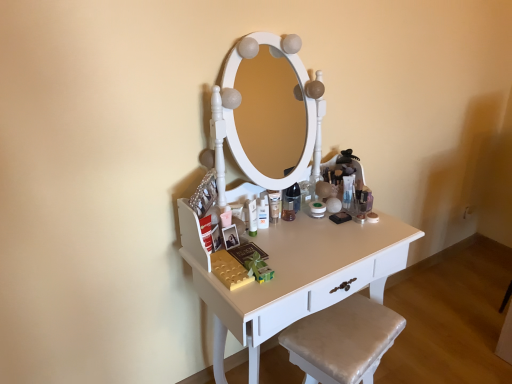
What is the approximate width of translucent plastic tube at center, arranged as the second toiletry when viewed from the front?

The width of translucent plastic tube at center, arranged as the second toiletry when viewed from the front, is 1.48 inches.

How much space does matte white lotion at center, which is the second toiletry in back-to-front order, occupy vertically?

The height of matte white lotion at center, which is the second toiletry in back-to-front order, is 5.04 inches.

The image size is (512, 384). In order to click on matte white lotion at center, which is the first toiletry from left to right in this screenshot , I will do `click(252, 217)`.

The image size is (512, 384). What do you see at coordinates (342, 340) in the screenshot?
I see `satin beige cushion at lower right` at bounding box center [342, 340].

Find the location of `white glossy table at center`. white glossy table at center is located at coordinates (296, 275).

Could you tell me if satin beige cushion at lower right is facing translucent plastic tube at center, arranged as the 1th toiletry when viewed from the right?

No.

Based on their positions, is satin beige cushion at lower right located to the left or right of translucent plastic tube at center, arranged as the 1th toiletry when viewed from the right?

From the image, it's evident that satin beige cushion at lower right is to the left of translucent plastic tube at center, arranged as the 1th toiletry when viewed from the right.

From a real-world perspective, between satin beige cushion at lower right and translucent plastic tube at center, arranged as the 1th toiletry when viewed from the right, who is vertically lower?

satin beige cushion at lower right is physically lower.

Is the position of satin beige cushion at lower right less distant than that of white glossy table at center?

No, it is not.

Considering the relative sizes of satin beige cushion at lower right and white glossy table at center in the image provided, is satin beige cushion at lower right wider than white glossy table at center?

In fact, satin beige cushion at lower right might be narrower than white glossy table at center.

Considering the relative sizes of satin beige cushion at lower right and white glossy table at center in the image provided, is satin beige cushion at lower right taller than white glossy table at center?

In fact, satin beige cushion at lower right may be shorter than white glossy table at center.

Which is farther, [351,187] or [295,340]?

The point [351,187] is more distant.

At what (x,y) coordinates should I click in order to perform the action: click on toiletry that is the 2nd object above the satin beige cushion at lower right (from a real-world perspective). Please return your answer as a coordinate pair (x, y). Looking at the image, I should click on (348, 190).

Is translucent plastic tube at center, the second toiletry viewed from the left, placed right next to satin beige cushion at lower right?

No, translucent plastic tube at center, the second toiletry viewed from the left, is not in contact with satin beige cushion at lower right.

Which is nearer, (273, 236) or (247, 207)?

Clearly, point (273, 236) is closer to the camera than point (247, 207).

From the image's perspective, is white glossy table at center above matte white lotion at center, the second toiletry from the right?

Actually, white glossy table at center appears below matte white lotion at center, the second toiletry from the right, in the image.

Could you tell me if white glossy table at center is facing matte white lotion at center, the second toiletry from the right?

No, white glossy table at center does not turn towards matte white lotion at center, the second toiletry from the right.

Are white glossy table at center and matte white lotion at center, the 1th toiletry from the front, making contact?

No, white glossy table at center is not beside matte white lotion at center, the 1th toiletry from the front.

Does white glossy table at center contain translucent plastic tube at center, arranged as the 1th toiletry when viewed from the right?

No, translucent plastic tube at center, arranged as the 1th toiletry when viewed from the right, is not a part of white glossy table at center.

Can you confirm if white glossy table at center is bigger than translucent plastic tube at center, the first toiletry positioned from the back?

Yes, white glossy table at center is bigger than translucent plastic tube at center, the first toiletry positioned from the back.

Is white glossy table at center placed right next to translucent plastic tube at center, arranged as the 1th toiletry when viewed from the right?

No, white glossy table at center is not next to translucent plastic tube at center, arranged as the 1th toiletry when viewed from the right.

This screenshot has height=384, width=512. In order to click on toiletry above the matte white lotion at center, which is the second toiletry in back-to-front order (from the image's perspective) in this screenshot , I will do `click(348, 190)`.

Is matte white lotion at center, which is the first toiletry from left to right, in contact with translucent plastic tube at center, the first toiletry positioned from the back?

No, matte white lotion at center, which is the first toiletry from left to right, is not making contact with translucent plastic tube at center, the first toiletry positioned from the back.

Is the position of matte white lotion at center, the second toiletry from the right, less distant than that of translucent plastic tube at center, the first toiletry positioned from the back?

Yes, it is in front of translucent plastic tube at center, the first toiletry positioned from the back.

Is matte white lotion at center, the 1th toiletry from the front, looking in the opposite direction of translucent plastic tube at center, the first toiletry positioned from the back?

No, matte white lotion at center, the 1th toiletry from the front,'s orientation is not away from translucent plastic tube at center, the first toiletry positioned from the back.

Considering the sizes of objects satin beige cushion at lower right and matte white lotion at center, the second toiletry from the right, in the image provided, who is wider, satin beige cushion at lower right or matte white lotion at center, the second toiletry from the right,?

Wider between the two is satin beige cushion at lower right.

Is satin beige cushion at lower right taller or shorter than matte white lotion at center, the second toiletry from the right?

satin beige cushion at lower right is taller than matte white lotion at center, the second toiletry from the right.

In the image, there is a matte white lotion at center, the second toiletry from the right. Where is `step stool below it (from the image's perspective)`? Image resolution: width=512 pixels, height=384 pixels. step stool below it (from the image's perspective) is located at coordinates (342, 340).

Does satin beige cushion at lower right contain matte white lotion at center, the 1th toiletry from the front?

No, matte white lotion at center, the 1th toiletry from the front, is not inside satin beige cushion at lower right.

Locate an element on the screen. This screenshot has height=384, width=512. toiletry that appears on the right of satin beige cushion at lower right is located at coordinates (348, 190).

At what (x,y) coordinates should I click in order to perform the action: click on table in front of the satin beige cushion at lower right. Please return your answer as a coordinate pair (x, y). Image resolution: width=512 pixels, height=384 pixels. Looking at the image, I should click on (296, 275).

From the image, which object appears to be farther from white glossy table at center, matte white lotion at center, which is the first toiletry from left to right, or satin beige cushion at lower right?

Among the two, matte white lotion at center, which is the first toiletry from left to right, is located further to white glossy table at center.

Based on the photo, which object lies further to the anchor point satin beige cushion at lower right, translucent plastic tube at center, the first toiletry positioned from the back, or matte white lotion at center, which is the second toiletry in back-to-front order?

translucent plastic tube at center, the first toiletry positioned from the back, is further to satin beige cushion at lower right.

Which object lies further to the anchor point matte white lotion at center, which is the first toiletry from left to right, satin beige cushion at lower right or white glossy table at center?

satin beige cushion at lower right.

From the picture: Looking at the image, which one is located further to matte white lotion at center, the second toiletry from the right, white glossy table at center or satin beige cushion at lower right?

satin beige cushion at lower right lies further to matte white lotion at center, the second toiletry from the right, than the other object.

Considering their positions, is matte white lotion at center, the 1th toiletry from the front, positioned further to white glossy table at center than translucent plastic tube at center, the second toiletry viewed from the left?

translucent plastic tube at center, the second toiletry viewed from the left, is further to white glossy table at center.

In the scene shown: Considering their positions, is white glossy table at center positioned further to matte white lotion at center, the 1th toiletry from the front, than translucent plastic tube at center, the second toiletry viewed from the left?

The object further to matte white lotion at center, the 1th toiletry from the front, is translucent plastic tube at center, the second toiletry viewed from the left.

Looking at the image, which one is located further to translucent plastic tube at center, the second toiletry viewed from the left, white glossy table at center or satin beige cushion at lower right?

The object further to translucent plastic tube at center, the second toiletry viewed from the left, is satin beige cushion at lower right.

Based on their spatial positions, is matte white lotion at center, the second toiletry from the right, or satin beige cushion at lower right closer to translucent plastic tube at center, the second toiletry viewed from the left?

matte white lotion at center, the second toiletry from the right, is closer to translucent plastic tube at center, the second toiletry viewed from the left.

Image resolution: width=512 pixels, height=384 pixels. Identify the location of toiletry between translucent plastic tube at center, the second toiletry viewed from the left, and white glossy table at center in the up-down direction. coord(252,217).

What are the coordinates of `table that lies between matte white lotion at center, which is the first toiletry from left to right, and satin beige cushion at lower right from top to bottom` in the screenshot? It's located at (296, 275).

In order to click on table between translucent plastic tube at center, arranged as the 1th toiletry when viewed from the right, and satin beige cushion at lower right in the up-down direction in this screenshot , I will do `click(296, 275)`.

Identify the location of toiletry between translucent plastic tube at center, the first toiletry positioned from the back, and satin beige cushion at lower right from top to bottom. (252, 217).